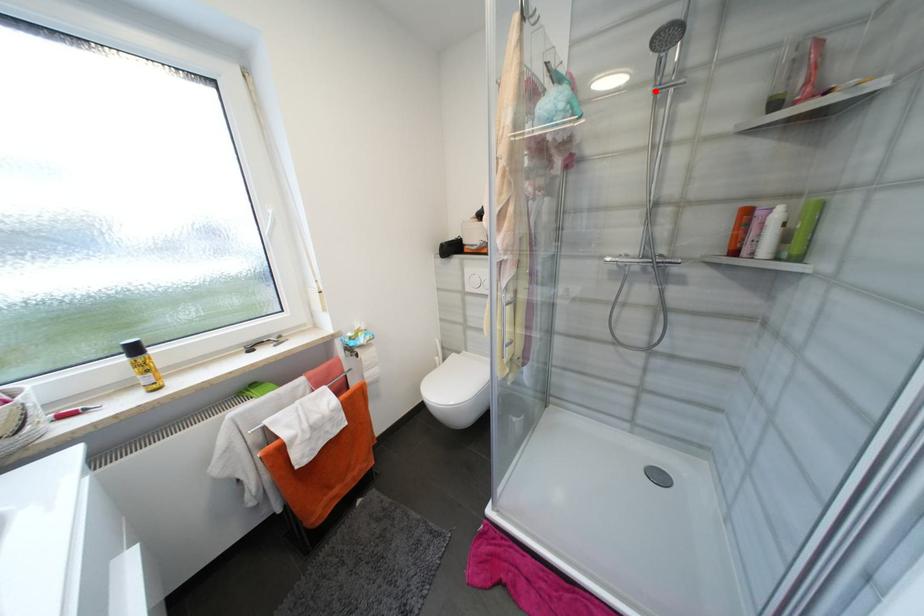
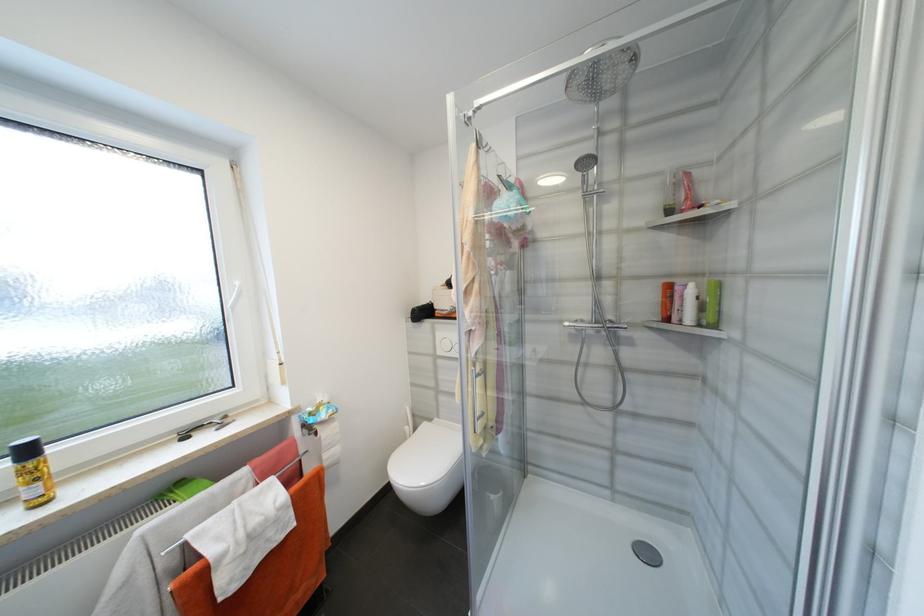
Where in the second image is the point corresponding to the highlighted location from the first image?

(586, 195)